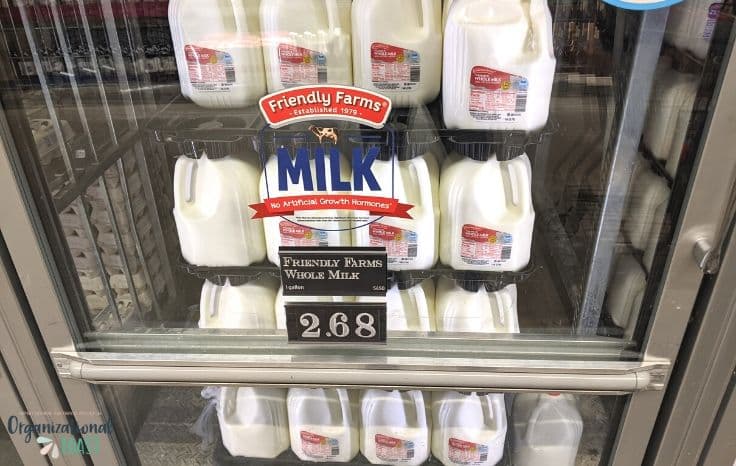
Locate an element on the screen. vertical metal refrigerator bars is located at coordinates (49, 101), (77, 88), (105, 82), (127, 75), (93, 245), (116, 233), (130, 227), (155, 212), (160, 175).